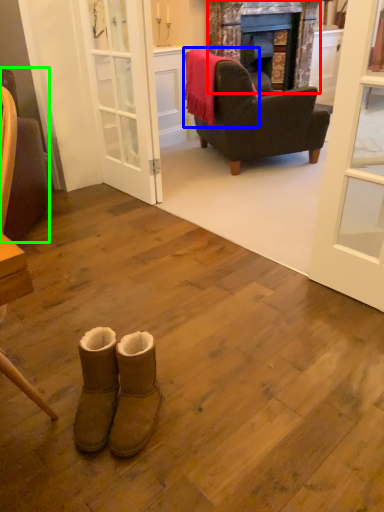
Question: Considering the real-world distances, which object is farthest from fireplace (highlighted by a red box)? blanket (highlighted by a blue box) or chair (highlighted by a green box)?

Choices:
 (A) blanket
 (B) chair

Answer: (B)